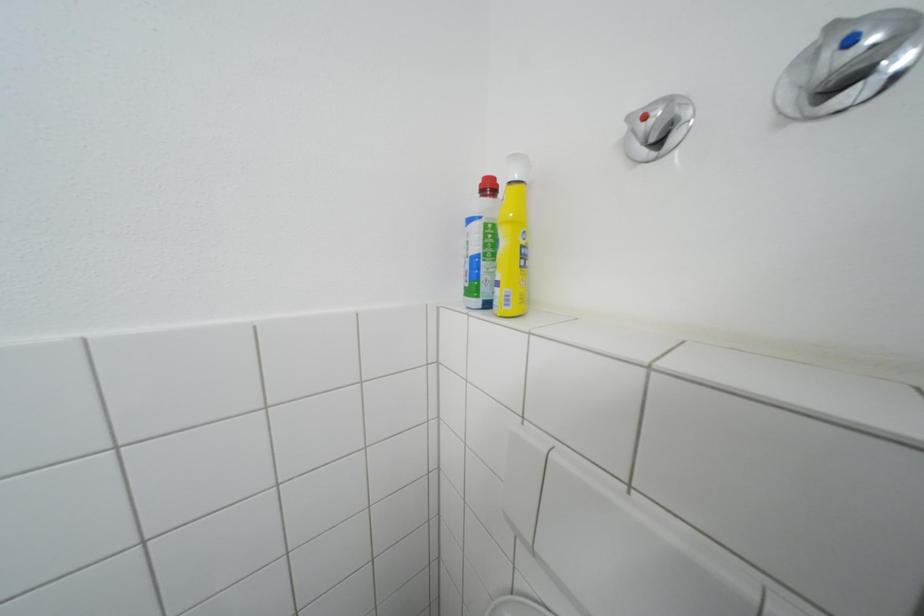
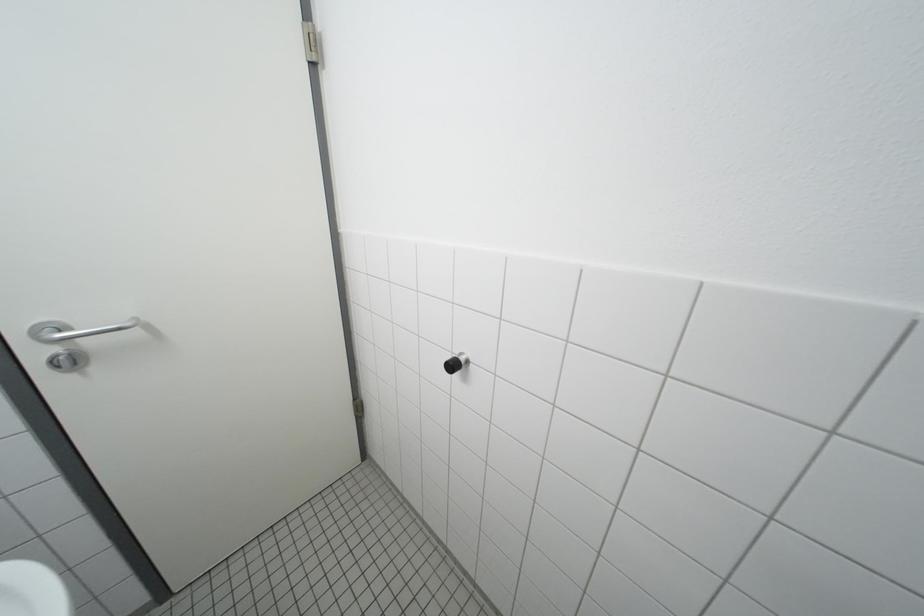
The images are taken continuously from a first-person perspective. In which direction is your viewpoint rotating?

The rotation direction of the camera is left-down.